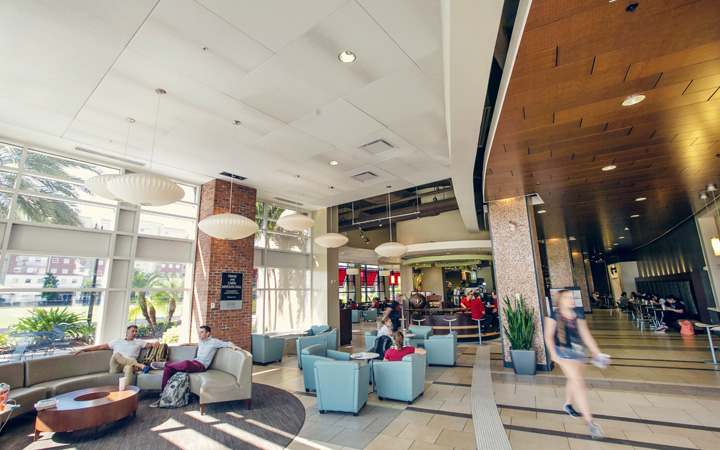
Identify the location of plant vase. This screenshot has width=720, height=450. (525, 360).